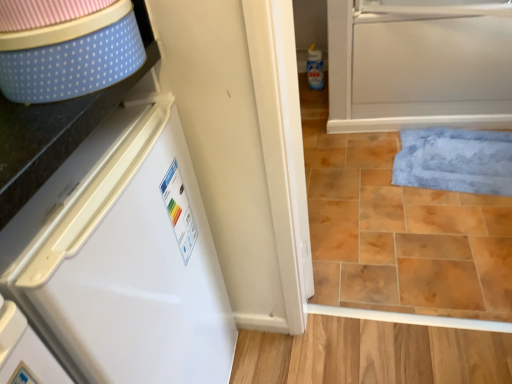
Question: Can you confirm if blue plush bath mat at lower right is positioned to the left of white glossy refrigerator at left?

Choices:
 (A) yes
 (B) no

Answer: (B)

Question: From a real-world perspective, is blue plush bath mat at lower right on top of white glossy refrigerator at left?

Choices:
 (A) yes
 (B) no

Answer: (B)

Question: Are blue plush bath mat at lower right and white glossy refrigerator at left making contact?

Choices:
 (A) yes
 (B) no

Answer: (B)

Question: Is blue plush bath mat at lower right wider than white glossy refrigerator at left?

Choices:
 (A) yes
 (B) no

Answer: (B)

Question: Would you say blue plush bath mat at lower right is outside white glossy refrigerator at left?

Choices:
 (A) yes
 (B) no

Answer: (A)

Question: From a real-world perspective, is blue plush bath mat at lower right positioned under white glossy refrigerator at left based on gravity?

Choices:
 (A) yes
 (B) no

Answer: (A)

Question: From the image's perspective, is white glossy refrigerator at left on blue plush bath mat at lower right?

Choices:
 (A) yes
 (B) no

Answer: (B)

Question: Does white glossy refrigerator at left have a smaller size compared to blue plush bath mat at lower right?

Choices:
 (A) yes
 (B) no

Answer: (B)

Question: Is white glossy refrigerator at left turned away from blue plush bath mat at lower right?

Choices:
 (A) no
 (B) yes

Answer: (A)

Question: Does white glossy refrigerator at left turn towards blue plush bath mat at lower right?

Choices:
 (A) yes
 (B) no

Answer: (B)

Question: Are white glossy refrigerator at left and blue plush bath mat at lower right beside each other?

Choices:
 (A) yes
 (B) no

Answer: (B)

Question: Is white glossy refrigerator at left thinner than blue plush bath mat at lower right?

Choices:
 (A) yes
 (B) no

Answer: (B)

Question: Is blue plush bath mat at lower right bigger or smaller than white glossy refrigerator at left?

Choices:
 (A) big
 (B) small

Answer: (B)